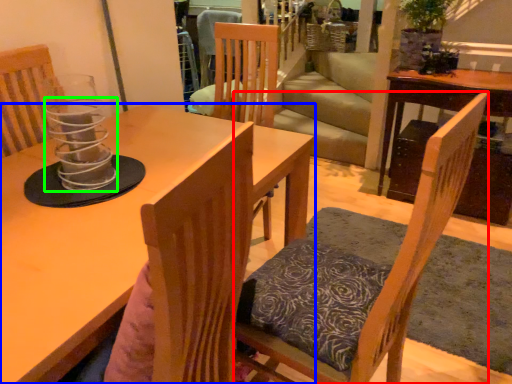
Question: Estimate the real-world distances between objects in this image. Which object is farther from chair (highlighted by a red box), table (highlighted by a blue box) or candle holder (highlighted by a green box)?

Choices:
 (A) table
 (B) candle holder

Answer: (B)